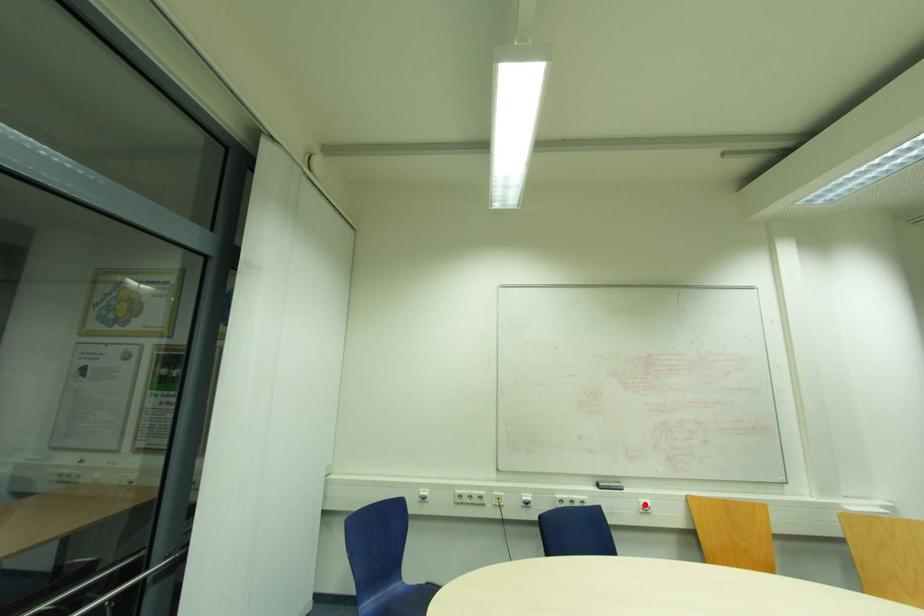
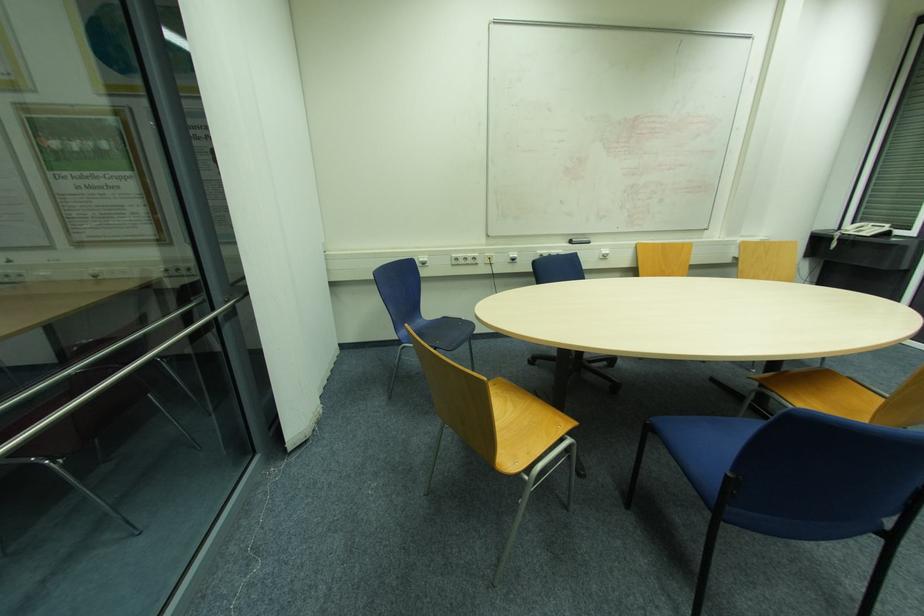
The point at the highlighted location is marked in the first image. Where is the corresponding point in the second image?

(604, 253)